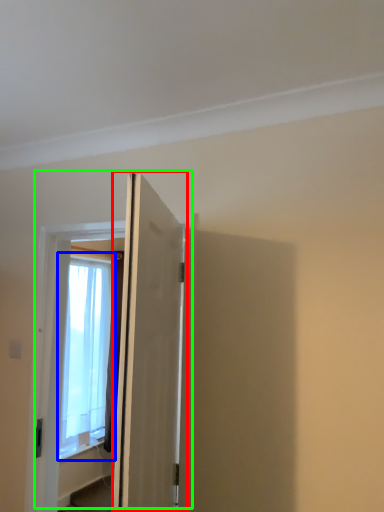
Question: Considering the real-world distances, which object is closest to door (highlighted by a red box)? window (highlighted by a blue box) or door (highlighted by a green box).

Choices:
 (A) window
 (B) door

Answer: (B)